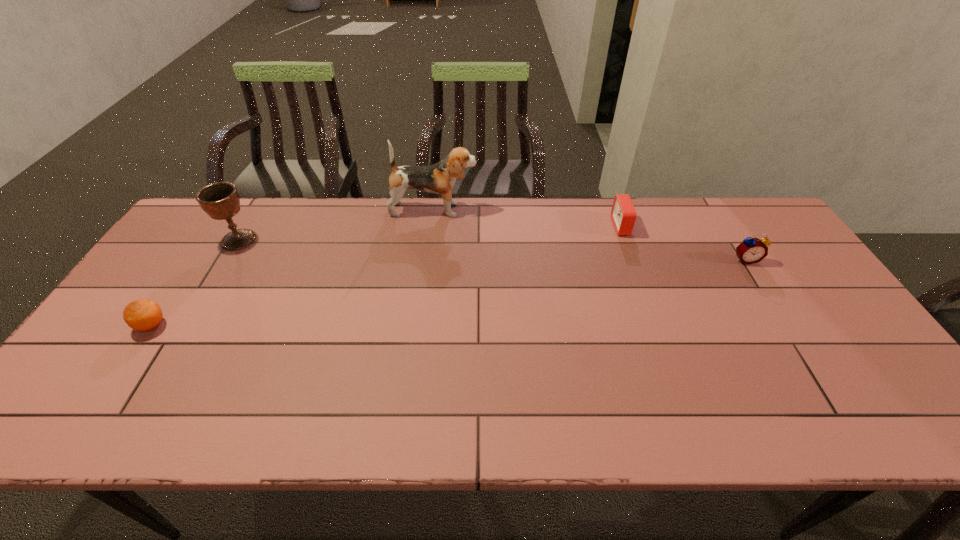
At what (x,y) coordinates should I click in order to perform the action: click on free space between the taller alarm clock and the fourth shortest object. Please return your answer as a coordinate pair (x, y). Looking at the image, I should click on (492, 249).

The height and width of the screenshot is (540, 960). I want to click on free point between the shorter alarm clock and the second nearest object, so click(684, 243).

I want to click on vacant space that's between the orange and the third object from left to right, so click(x=293, y=268).

Locate an element on the screen. Image resolution: width=960 pixels, height=540 pixels. blank region between the taller alarm clock and the orange is located at coordinates (448, 293).

You are a GUI agent. You are given a task and a screenshot of the screen. Output one action in this format:
    pyautogui.click(x=<x>, y=<y>)
    Task: Click on the blank region between the third object from left to right and the orange
    The image size is (960, 540).
    Given the screenshot: What is the action you would take?
    pyautogui.click(x=293, y=268)

Find the location of a particular element. vacant space in between the orange and the shorter alarm clock is located at coordinates (387, 276).

Locate an element on the screen. The height and width of the screenshot is (540, 960). empty space between the puppy and the nearest object is located at coordinates coord(293,268).

Image resolution: width=960 pixels, height=540 pixels. Identify the location of empty space between the tallest object and the rightmost object. (589, 235).

At what (x,y) coordinates should I click in order to perform the action: click on object that is the second closest one to the tallest object. Please return your answer as a coordinate pair (x, y). The height and width of the screenshot is (540, 960). Looking at the image, I should click on (623, 214).

The width and height of the screenshot is (960, 540). Identify the location of the closest object to the third shortest object. (623, 214).